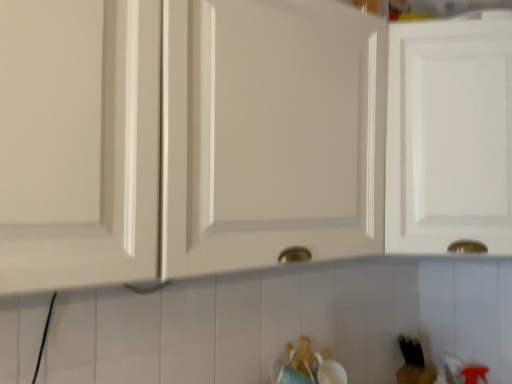
Question: From a real-world perspective, is white glossy cabinet door at upper right, the first cabinetry when ordered from right to left, on white glossy cabinet at center, the second cabinetry when ordered from right to left?

Choices:
 (A) yes
 (B) no

Answer: (A)

Question: Is the position of white glossy cabinet door at upper right, the first cabinetry when ordered from right to left, less distant than that of white glossy cabinet at center, the second cabinetry when ordered from right to left?

Choices:
 (A) yes
 (B) no

Answer: (B)

Question: From the image's perspective, is white glossy cabinet door at upper right, the 2th cabinetry positioned from the left, over white glossy cabinet at center, the second cabinetry when ordered from right to left?

Choices:
 (A) no
 (B) yes

Answer: (A)

Question: From a real-world perspective, is white glossy cabinet door at upper right, the first cabinetry when ordered from right to left, beneath white glossy cabinet at center, the first cabinetry positioned from the left?

Choices:
 (A) yes
 (B) no

Answer: (B)

Question: Considering the relative sizes of white glossy cabinet door at upper right, the 2th cabinetry positioned from the left, and white glossy cabinet at center, the first cabinetry positioned from the left, in the image provided, is white glossy cabinet door at upper right, the 2th cabinetry positioned from the left, wider than white glossy cabinet at center, the first cabinetry positioned from the left,?

Choices:
 (A) yes
 (B) no

Answer: (A)

Question: Does white glossy cabinet door at upper right, the first cabinetry when ordered from right to left, have a greater height compared to white glossy cabinet at center, the second cabinetry when ordered from right to left?

Choices:
 (A) yes
 (B) no

Answer: (A)

Question: Does brown plush bear at lower center, the first toy from the top, have a larger size compared to white glossy cabinet door at upper right, the first cabinetry when ordered from right to left?

Choices:
 (A) yes
 (B) no

Answer: (B)

Question: Is brown plush bear at lower center, positioned as the first toy in left-to-right order, touching white glossy cabinet door at upper right, the 2th cabinetry positioned from the left?

Choices:
 (A) no
 (B) yes

Answer: (A)

Question: Considering the relative sizes of brown plush bear at lower center, positioned as the first toy in front-to-back order, and white glossy cabinet door at upper right, the first cabinetry when ordered from right to left, in the image provided, is brown plush bear at lower center, positioned as the first toy in front-to-back order, smaller than white glossy cabinet door at upper right, the first cabinetry when ordered from right to left,?

Choices:
 (A) no
 (B) yes

Answer: (B)

Question: Could you tell me if brown plush bear at lower center, positioned as the first toy in left-to-right order, is facing white glossy cabinet door at upper right, the 2th cabinetry positioned from the left?

Choices:
 (A) yes
 (B) no

Answer: (B)

Question: Is there a large distance between brown plush bear at lower center, positioned as the first toy in front-to-back order, and white glossy cabinet door at upper right, the 2th cabinetry positioned from the left?

Choices:
 (A) no
 (B) yes

Answer: (A)

Question: From a real-world perspective, does brown plush bear at lower center, the 2th toy when ordered from right to left, sit lower than white glossy cabinet door at upper right, the 2th cabinetry positioned from the left?

Choices:
 (A) no
 (B) yes

Answer: (B)

Question: Is white glossy cabinet at center, the second cabinetry when ordered from right to left, placed right next to black matte bear at lower right, the second toy positioned from the front?

Choices:
 (A) no
 (B) yes

Answer: (A)